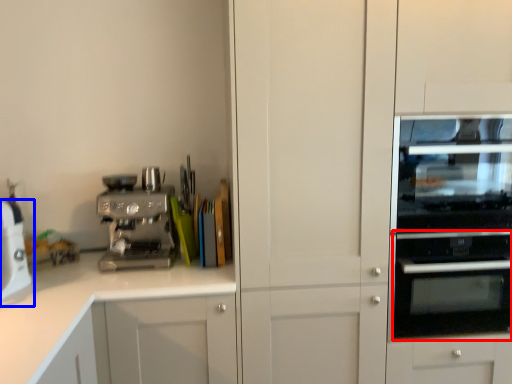
Question: Which of the following is the farthest to the observer, oven (highlighted by a red box) or home appliance (highlighted by a blue box)?

Choices:
 (A) oven
 (B) home appliance

Answer: (A)